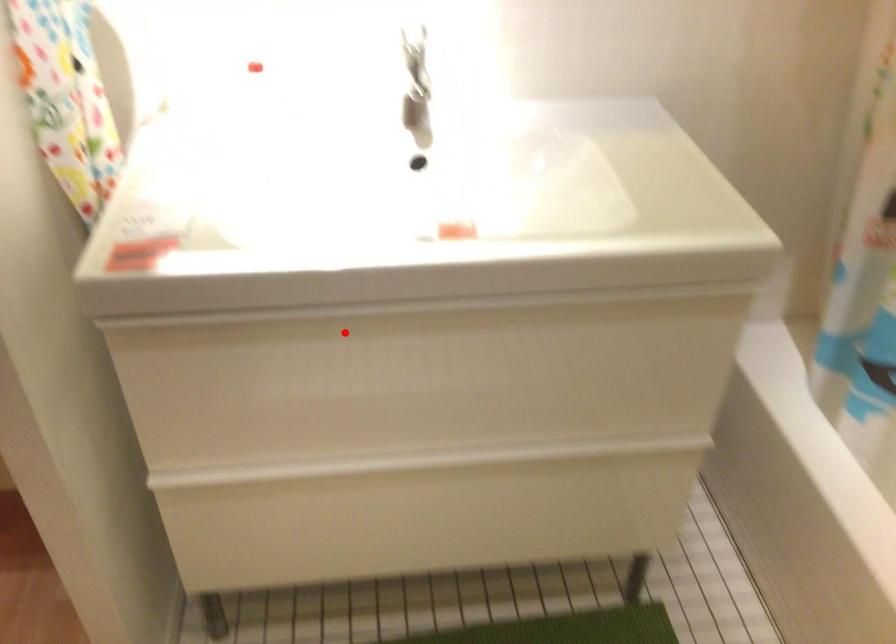
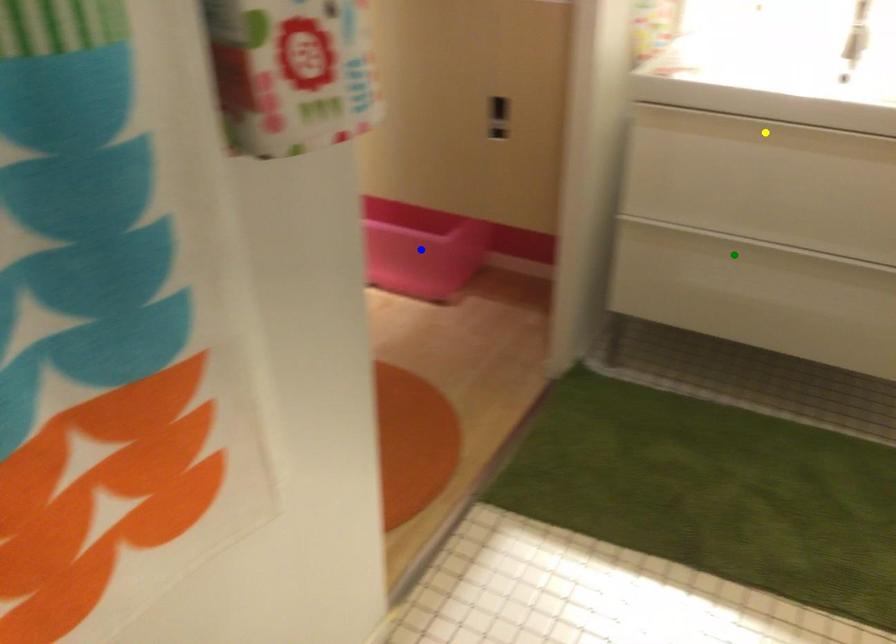
Question: I am providing you with two images of the same scene from different viewpoints. A red point is marked on the first image. You are given multiple points on the second image. Which mark in image 2 goes with the point in image 1?

Choices:
 (A) blue point
 (B) yellow point
 (C) green point

Answer: (B)